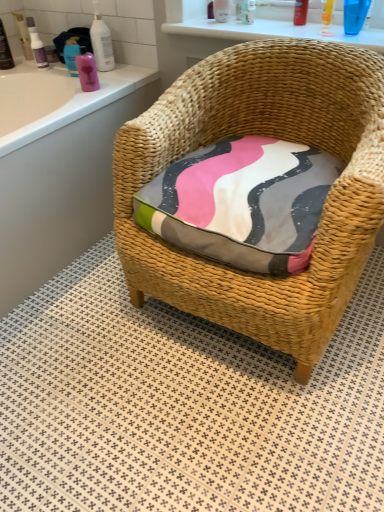
The image size is (384, 512). In order to click on blank space to the left of transparent plastic cup at upper right, the 1th toiletry from the right in this screenshot , I will do `click(316, 32)`.